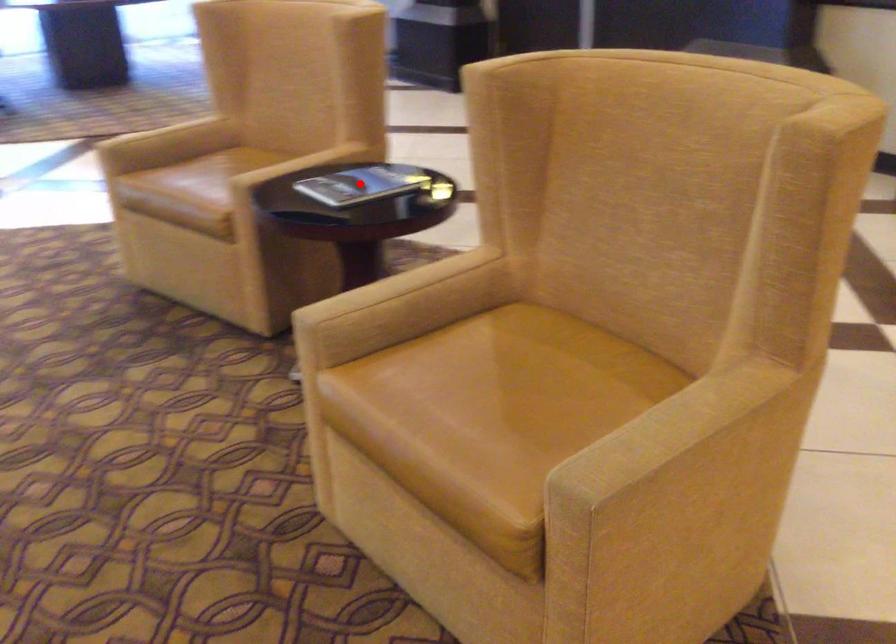
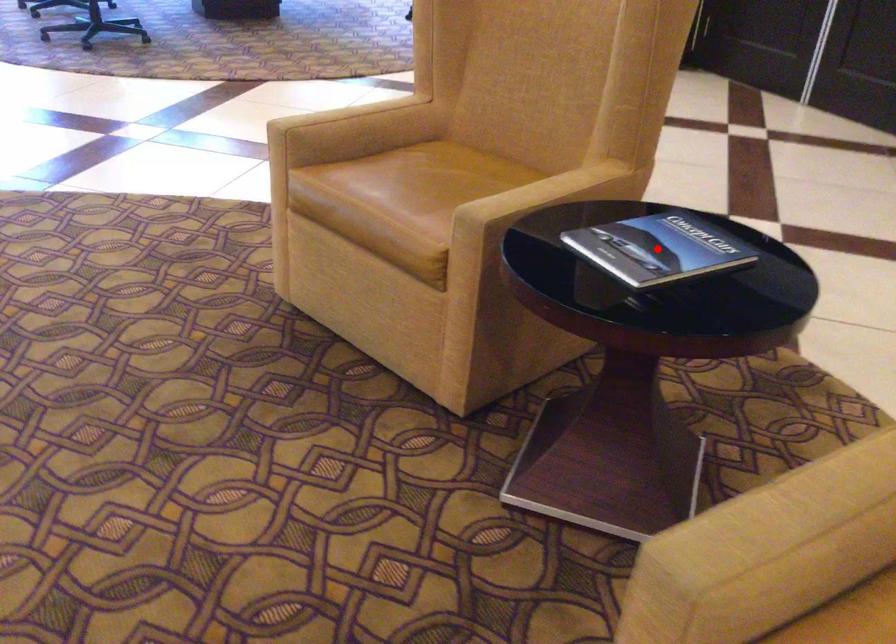
I am providing you with two images of the same scene from different viewpoints. A red point is marked on the first image and another point is marked on the second image. Is the red point in image1 aligned with the point shown in image2?

Yes